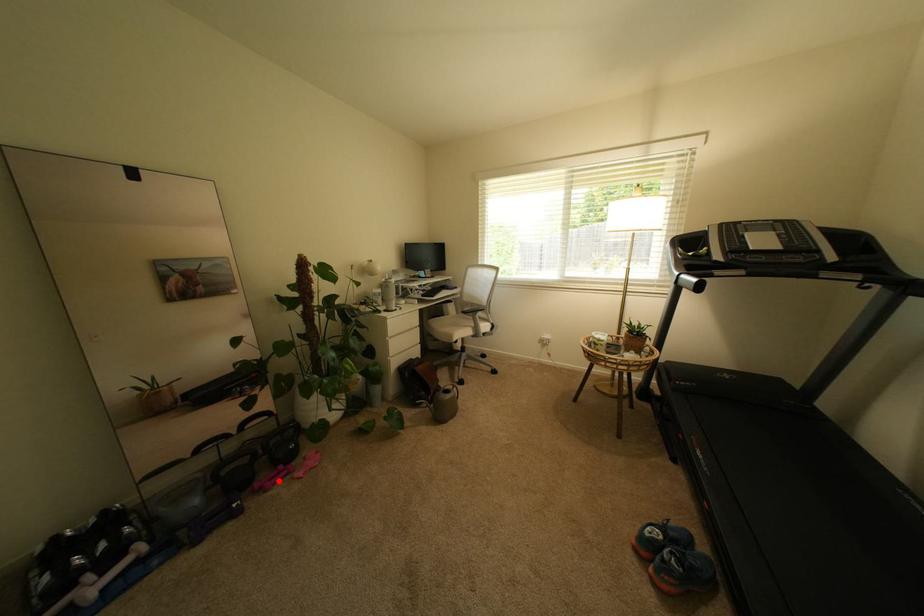
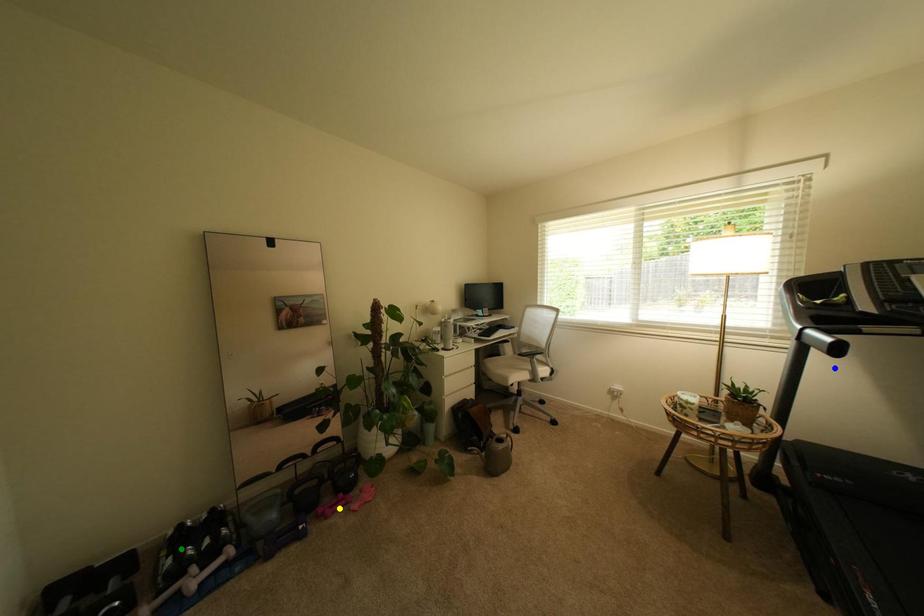
Question: I am providing you with two images of the same scene from different viewpoints. A red point is marked on the first image. You are given multiple points on the second image. Can you choose the point in image 2 that corresponds to the point in image 1?

Choices:
 (A) blue point
 (B) yellow point
 (C) green point

Answer: (B)